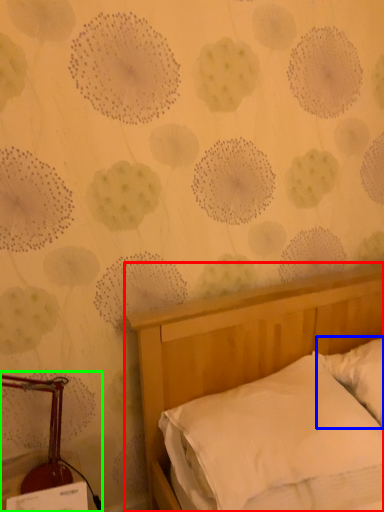
Question: Which object is positioned farthest from bed (highlighted by a red box)? Select from pillow (highlighted by a blue box) and bedside lamp (highlighted by a green box).

Choices:
 (A) pillow
 (B) bedside lamp

Answer: (B)